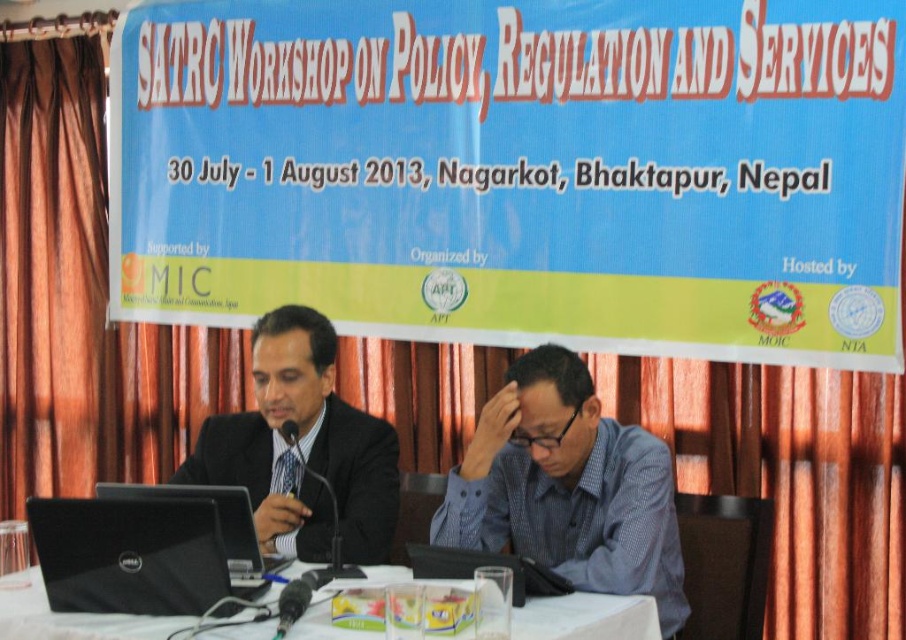
Does blue checkered shirt at center have a greater width compared to dell matte black laptop at lower left?

Correct, the width of blue checkered shirt at center exceeds that of dell matte black laptop at lower left.

Between point (605, 433) and point (124, 499), which one is positioned behind?

The point (605, 433) is behind.

Does point (514, 420) come closer to viewer compared to point (230, 502)?

No.

You are a GUI agent. You are given a task and a screenshot of the screen. Output one action in this format:
    pyautogui.click(x=<x>, y=<y>)
    Task: Click on the blue checkered shirt at center
    
    Given the screenshot: What is the action you would take?
    (x=567, y=486)

Looking at this image, does blue checkered shirt at center have a larger size compared to black glossy suit at center?

Yes.

I want to click on blue checkered shirt at center, so click(x=567, y=486).

This screenshot has width=906, height=640. I want to click on white cloth table at center, so pyautogui.click(x=586, y=618).

Between white cloth table at center and dell matte black laptop at lower left, which one appears on the left side from the viewer's perspective?

Positioned to the left is white cloth table at center.

Which is behind, point (353, 632) or point (220, 500)?

The point (220, 500) is more distant.

I want to click on white cloth table at center, so click(x=586, y=618).